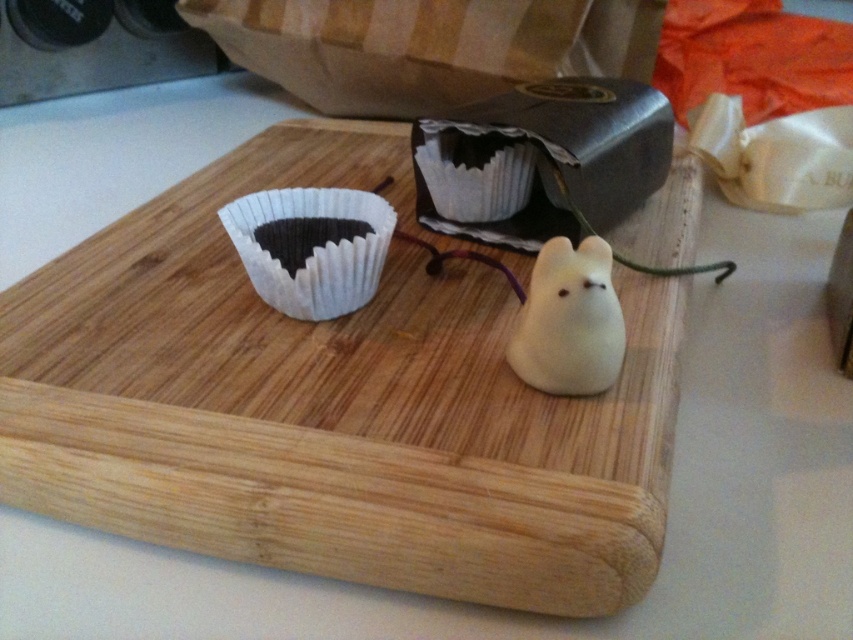
Question: Does wooden cutting board at center lie in front of white matte mouse at center?

Choices:
 (A) no
 (B) yes

Answer: (B)

Question: Estimate the real-world distances between objects in this image. Which object is farther from the white matte mouse at center?

Choices:
 (A) wooden cutting board at center
 (B) matte white paper cupcake at center
 (C) white paper cupcake at upper left

Answer: (C)

Question: Is wooden cutting board at center smaller than white matte mouse at center?

Choices:
 (A) yes
 (B) no

Answer: (B)

Question: In this image, where is wooden cutting board at center located relative to matte white paper cupcake at center?

Choices:
 (A) right
 (B) left

Answer: (B)

Question: Among these objects, which one is nearest to the camera?

Choices:
 (A) white matte mouse at center
 (B) white paper cupcake at upper left
 (C) wooden cutting board at center
 (D) matte white paper cupcake at center

Answer: (C)

Question: Which object is positioned farthest from the wooden cutting board at center?

Choices:
 (A) white paper cupcake at upper left
 (B) white matte mouse at center

Answer: (B)